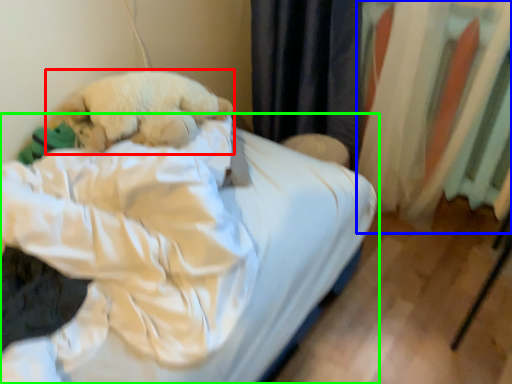
Question: Which object is positioned closest to dog (highlighted by a red box)? Select from curtain (highlighted by a blue box) and bed (highlighted by a green box).

Choices:
 (A) curtain
 (B) bed

Answer: (B)